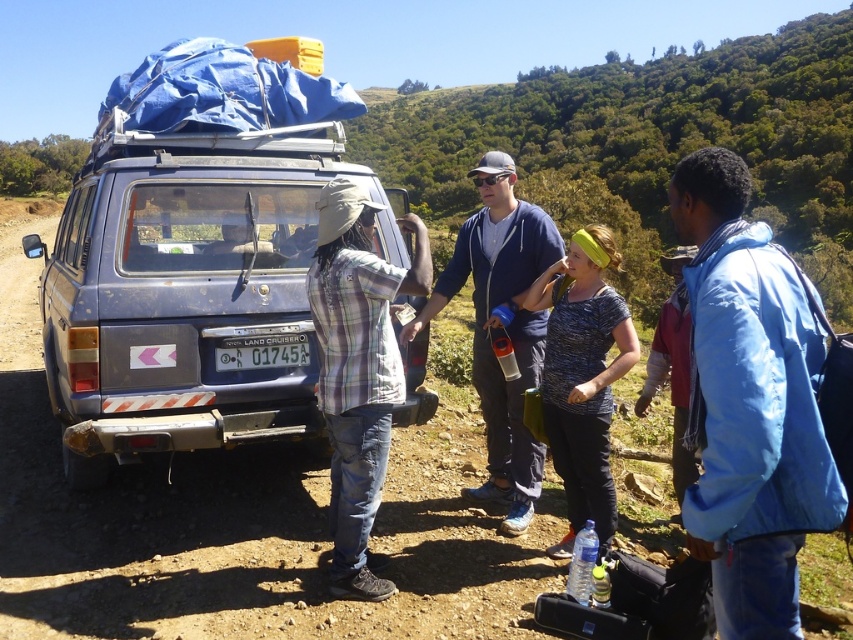
Looking at this image, you are a photographer trying to capture a clear shot of both the printed cotton shirt at center and the white plastic license plate at center in the scene. Since you want both subjects to be clearly visible, which object should you focus on first considering their sizes?

The printed cotton shirt at center has a greater height compared to the white plastic license plate at center, so you should focus on the printed cotton shirt at center first to ensure its details are sharp before adjusting for the smaller license plate.

You are standing at the point with coordinates point (502,326). What is the color of the clothing item you are currently standing on?

The point (502,326) is on the blue cotton shirt at center, so the color of the clothing item is blue.

You are trying to determine which person to approach for assistance. Based on the spatial arrangement of the plaid shirt at center and the blue cotton shirt at center, which one is smaller in size and might be easier to approach?

The plaid shirt at center occupies less space than the blue cotton shirt at center, so it might be easier to approach the person wearing the plaid shirt at center since they are smaller in size.